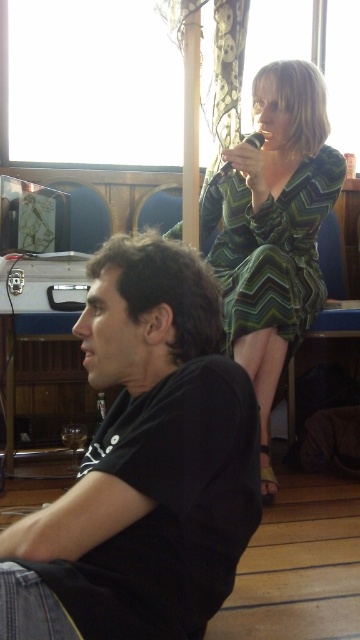
You are organizing a photo shoot and need to ensure that all clothing items in the image are visible. Given the black matte shirt at lower left and the green zigzag dress at upper right, which clothing item takes up more space in the image?

The green zigzag dress at upper right takes up more space in the image than the black matte shirt at lower left.

You are a photographer who needs to capture a photo of both the black matte shirt at lower left and the green zigzag dress at upper right in the same frame. Based on their positions, which direction should you move your camera to ensure both are visible?

Since the black matte shirt at lower left is positioned on the left side of the green zigzag dress at upper right, you should move your camera to the left to include both objects in the frame.

You are a photographer setting up for a group photo. You need to position yourself so that both the black matte shirt at lower left and the green zigzag dress at upper right are in focus. Which object should you focus on first to ensure both are sharp?

You should focus on the black matte shirt at lower left first because it is closer to the viewer than the green zigzag dress at upper right. By focusing on the closer object, the depth of field will extend to include the farther object in acceptable focus.